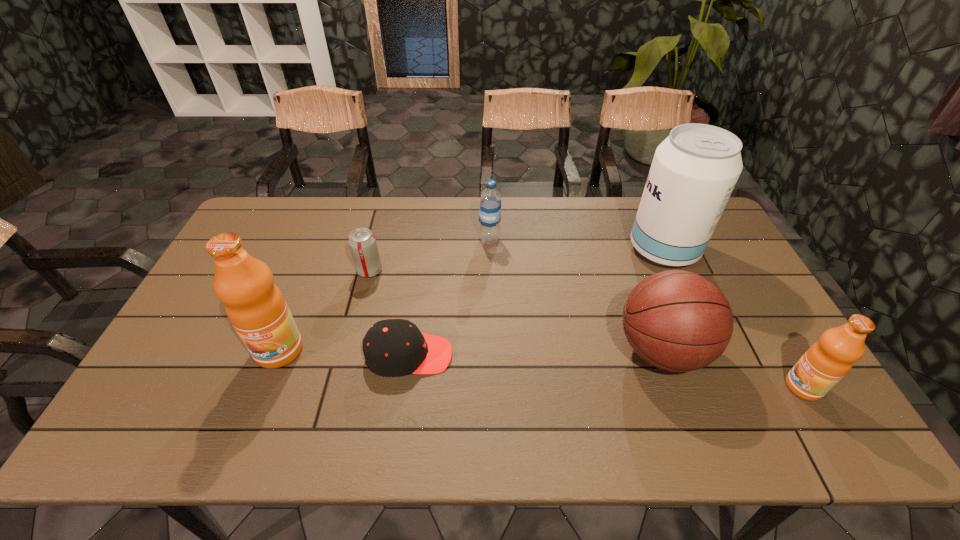
This screenshot has height=540, width=960. I want to click on free space located 0.310m on the front-facing side of the third object from left to right, so click(571, 355).

The height and width of the screenshot is (540, 960). Find the location of `free space located on the back of the basketball`. free space located on the back of the basketball is located at coordinates (632, 266).

The height and width of the screenshot is (540, 960). I want to click on water bottle that is at the far edge, so click(x=490, y=199).

Where is `alcohol that is positioned at the far edge`? The width and height of the screenshot is (960, 540). alcohol that is positioned at the far edge is located at coordinates (694, 170).

What are the coordinates of `fruit juice at the near edge` in the screenshot? It's located at (827, 361).

This screenshot has height=540, width=960. Find the location of `cap situated at the near edge`. cap situated at the near edge is located at coordinates (393, 347).

At what (x,y) coordinates should I click in order to perform the action: click on basketball present at the near edge. Please return your answer as a coordinate pair (x, y). Image resolution: width=960 pixels, height=540 pixels. Looking at the image, I should click on (679, 321).

This screenshot has height=540, width=960. In order to click on fruit juice at the right edge in this screenshot , I will do click(x=827, y=361).

I want to click on alcohol that is at the right edge, so click(x=694, y=170).

Find the location of a particular element. The height and width of the screenshot is (540, 960). object positioned at the far right corner is located at coordinates (694, 170).